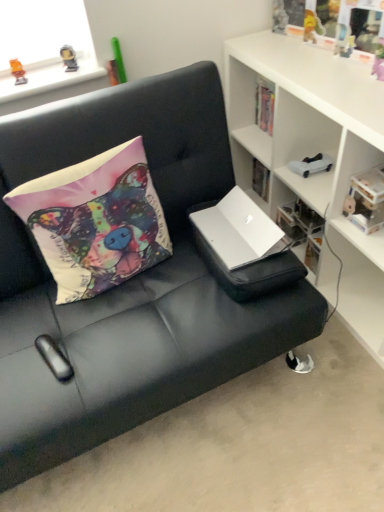
Image resolution: width=384 pixels, height=512 pixels. Find the location of `vacant region above white matte cabinet at upper right (from a real-world perspective)`. vacant region above white matte cabinet at upper right (from a real-world perspective) is located at coordinates (326, 65).